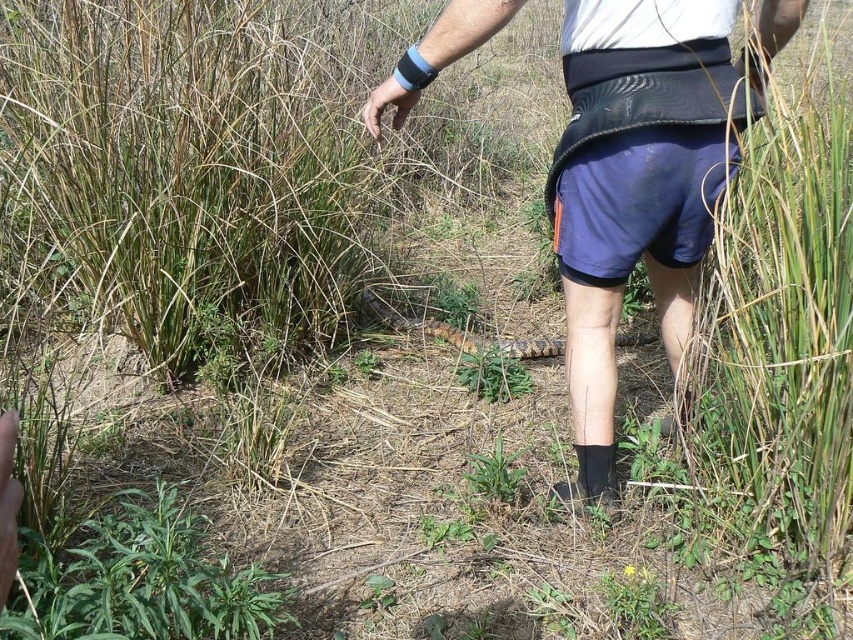
Question: Where is blue fabric shorts at center located in relation to green leafy plant at lower left in the image?

Choices:
 (A) above
 (B) below

Answer: (A)

Question: Does blue fabric shorts at center appear over green leafy plant at lower left?

Choices:
 (A) no
 (B) yes

Answer: (B)

Question: Which point is farther from the camera taking this photo?

Choices:
 (A) (572, 202)
 (B) (120, 504)

Answer: (B)

Question: Is blue fabric shorts at center wider than green leafy plant at lower left?

Choices:
 (A) no
 (B) yes

Answer: (B)

Question: Which of the following is the closest to the observer?

Choices:
 (A) green leafy plant at lower left
 (B) blue fabric shorts at center

Answer: (A)